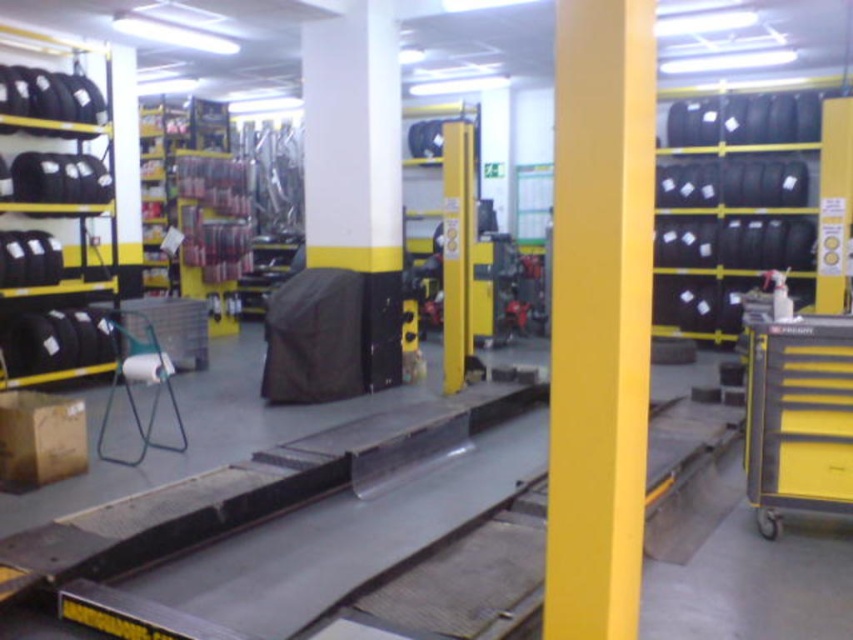
Question: Is black matte pillar at center closer to camera compared to black rubber tire at lower right?

Choices:
 (A) yes
 (B) no

Answer: (B)

Question: Which object is positioned closest to the black rubber tires at right?

Choices:
 (A) black rubber tire at upper left
 (B) yellow smooth pillar at center
 (C) yellow metal tool cart at right
 (D) black rubber tires at left

Answer: (C)

Question: Does yellow smooth pillar at center have a lesser width compared to black rubber tires at right?

Choices:
 (A) no
 (B) yes

Answer: (B)

Question: Is black rubber tires at right to the left of black matte pillar at center from the viewer's perspective?

Choices:
 (A) yes
 (B) no

Answer: (B)

Question: Which point appears farthest from the camera in this image?

Choices:
 (A) (606, 369)
 (B) (838, 448)
 (C) (91, 192)

Answer: (C)

Question: Which point is closer to the camera taking this photo?

Choices:
 (A) (305, 100)
 (B) (762, 509)
 (C) (618, 333)
 (D) (80, 214)

Answer: (C)